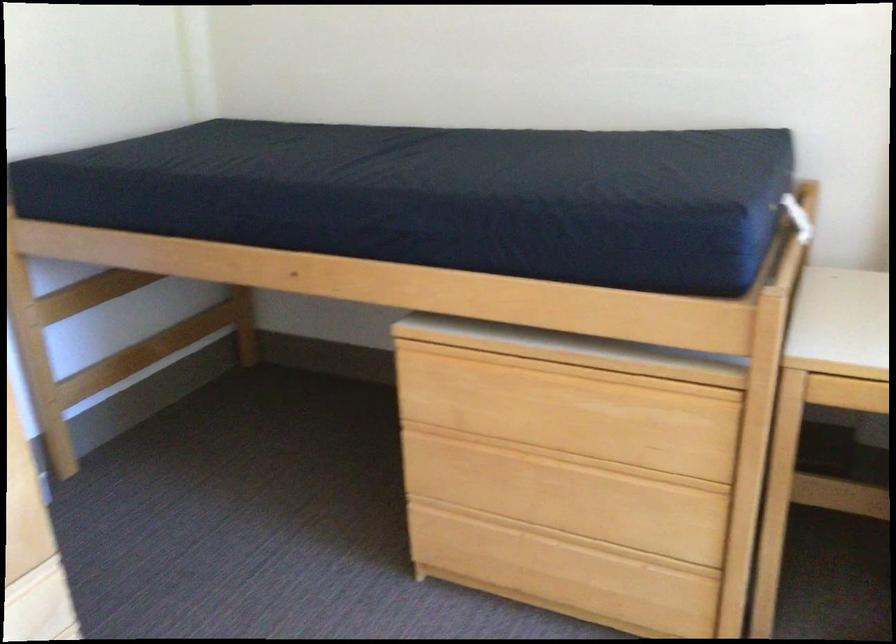
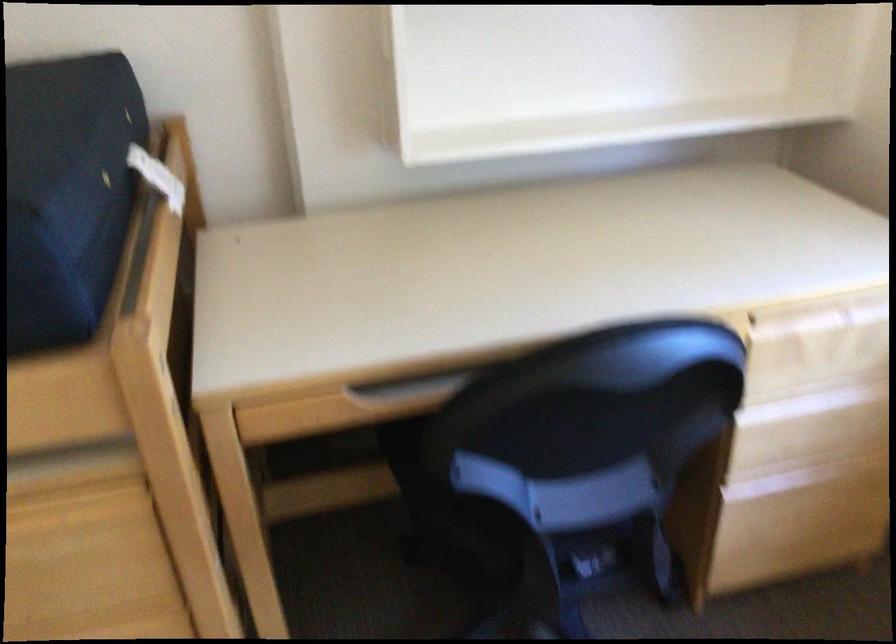
Question: The camera is either moving clockwise (left) or counter-clockwise (right) around the object. The first image is from the beginning of the video and the second image is from the end. Is the camera moving left or right when shooting the video?

Choices:
 (A) Left
 (B) Right

Answer: (A)